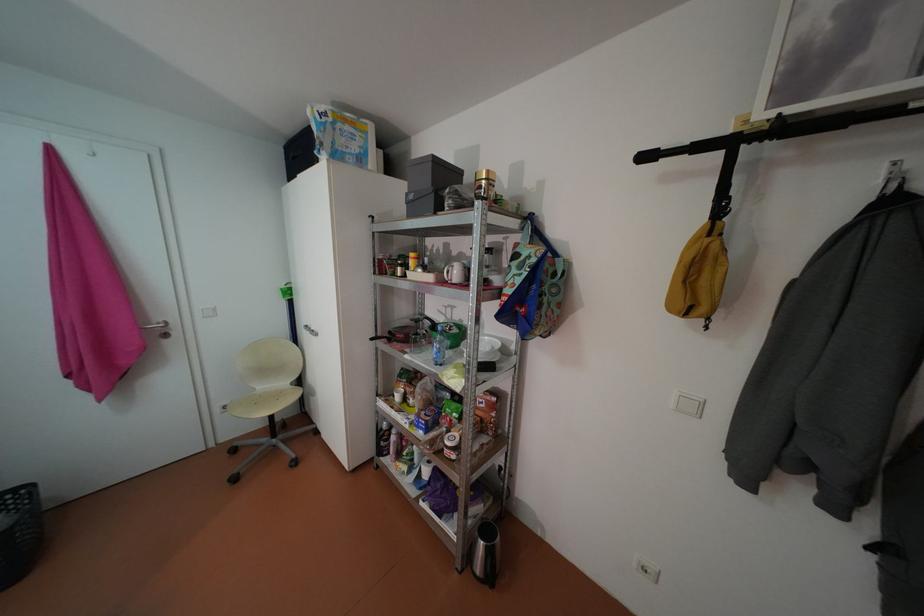
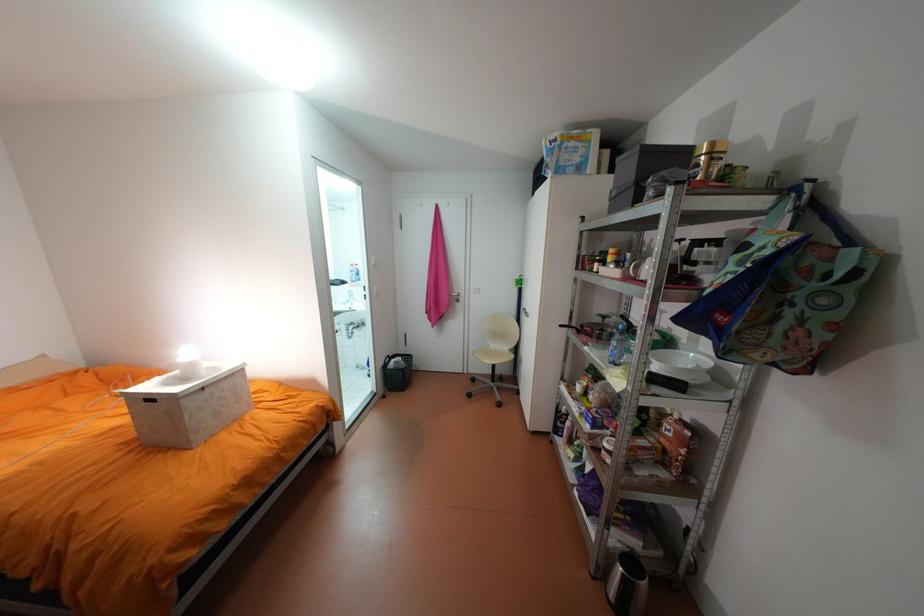
Where in the second image is the point corresponding to (x=502, y=346) from the first image?

(707, 367)